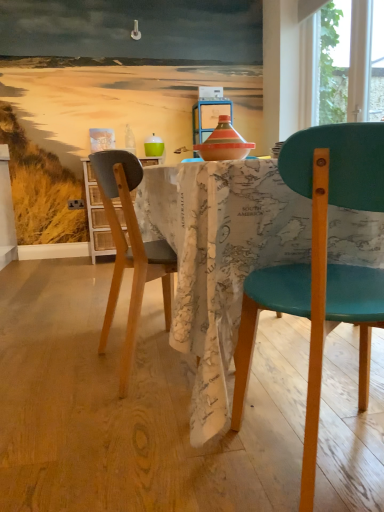
Question: Is map-patterned fabric at center taller or shorter than transparent glass window at upper right?

Choices:
 (A) short
 (B) tall

Answer: (A)

Question: From a real-world perspective, is map-patterned fabric at center physically located above or below transparent glass window at upper right?

Choices:
 (A) below
 (B) above

Answer: (A)

Question: Estimate the real-world distances between objects in this image. Which object is closer to the teal plastic chair at right, the second chair when ordered from left to right?

Choices:
 (A) wooden cabinet at left
 (B) transparent glass window at upper right
 (C) map-patterned fabric at center
 (D) translucent glass bottle at upper center
 (E) matte black chair at center, placed as the 2th chair when sorted from front to back

Answer: (C)

Question: Which object is positioned farthest from the matte black chair at center, the 1th chair viewed from the back?

Choices:
 (A) teal plastic chair at right, positioned as the second chair in back-to-front order
 (B) map-patterned fabric at center
 (C) white plastic power outlet at lower left
 (D) translucent glass bottle at upper center
 (E) wooden cabinet at left

Answer: (C)